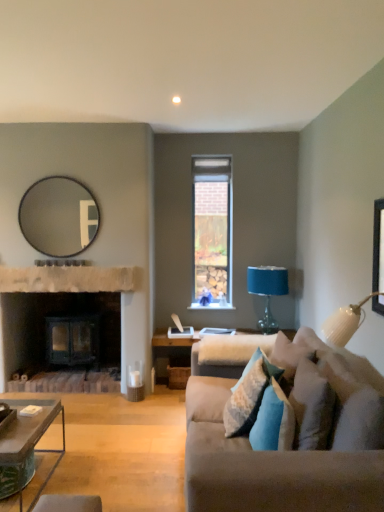
Question: Does point (294, 409) appear closer or farther from the camera than point (36, 494)?

Choices:
 (A) closer
 (B) farther

Answer: (A)

Question: In the image, is blue velvet pillow at lower right, the 4th pillow positioned from the back, positioned in front of or behind green textured coffee table at lower left?

Choices:
 (A) front
 (B) behind

Answer: (A)

Question: Estimate the real-world distances between objects in this image. Which object is closer to the rustic stone fireplace at center?

Choices:
 (A) brick textured window at center
 (B) green textured coffee table at lower left
 (C) velvet beige couch at right
 (D) matte black mirror at upper left
 (E) textured blue pillow at center, acting as the second pillow starting from the back

Answer: (D)

Question: Which of these objects is positioned farthest from the blue textured pillow at center, positioned as the fourth pillow in front-to-back order?

Choices:
 (A) matte black mirror at upper left
 (B) green textured coffee table at lower left
 (C) blue velvet pillow at lower right, which appears as the 2th pillow when viewed from the front
 (D) black matte picture frame at upper right
 (E) textured blue pillow at center, acting as the second pillow starting from the back

Answer: (A)